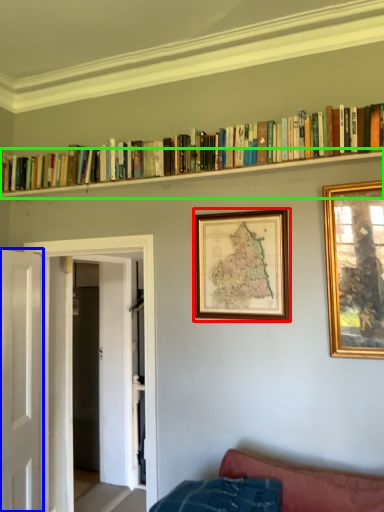
Question: Which object is the farthest from picture frame (highlighted by a red box)? Choose among these: door (highlighted by a blue box) or shelf (highlighted by a green box).

Choices:
 (A) door
 (B) shelf

Answer: (A)